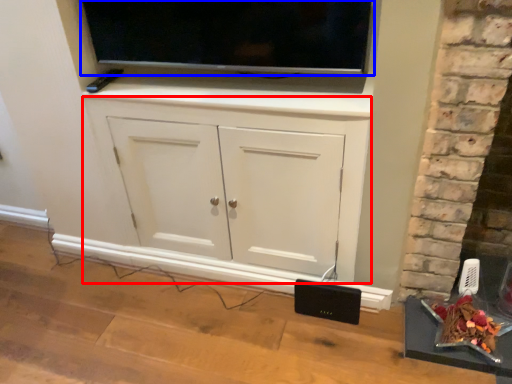
Question: Which of the following is the farthest to the observer, cabinetry (highlighted by a red box) or television (highlighted by a blue box)?

Choices:
 (A) cabinetry
 (B) television

Answer: (A)